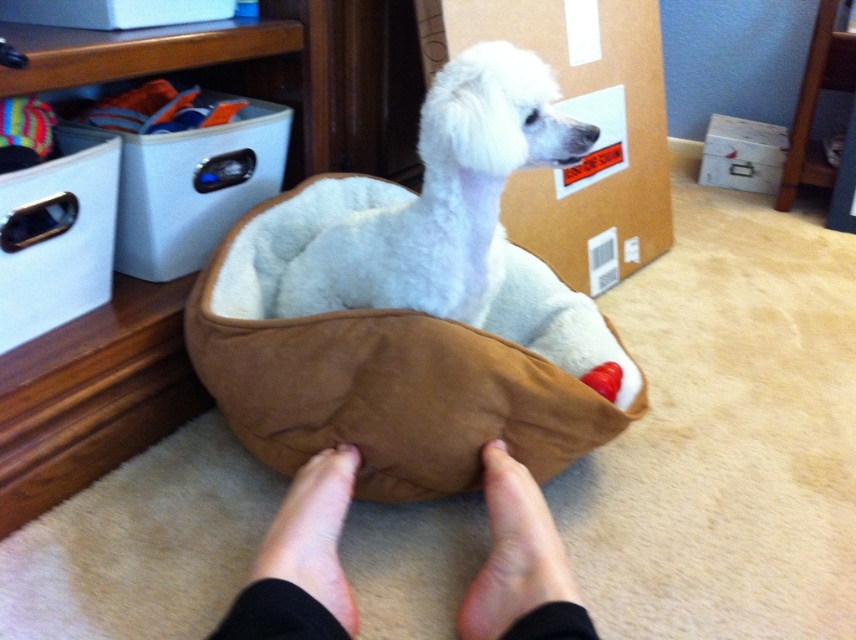
You are a pet owner who wants to place a new toy for the white plush dog at center. The toy comes in a white cardboard box at upper left. Can you place the toy directly above the dog without moving the box?

The white plush dog at center is below the white cardboard box at upper left, so placing the toy directly above the dog would require moving the box since the box is already in that position.

You are a dog owner trying to ensure your dog has enough space in its new bed. You see the white plush dog at center and the cardboard at upper center. Which object is closer to you?

The white plush dog at center is closer to you because it is in front of the cardboard at upper center.

You are standing in front of the pet bed and want to place a small treat. You have two points marked on the bed where you can place it. Which point, point 1 at coordinates (467,152) or point 2 at (651,24), is closer to you and thus better for placing the treat?

Point 1 at coordinates (467,152) is closer to the viewer than point 2 at (651,24), so it is better for placing the treat.